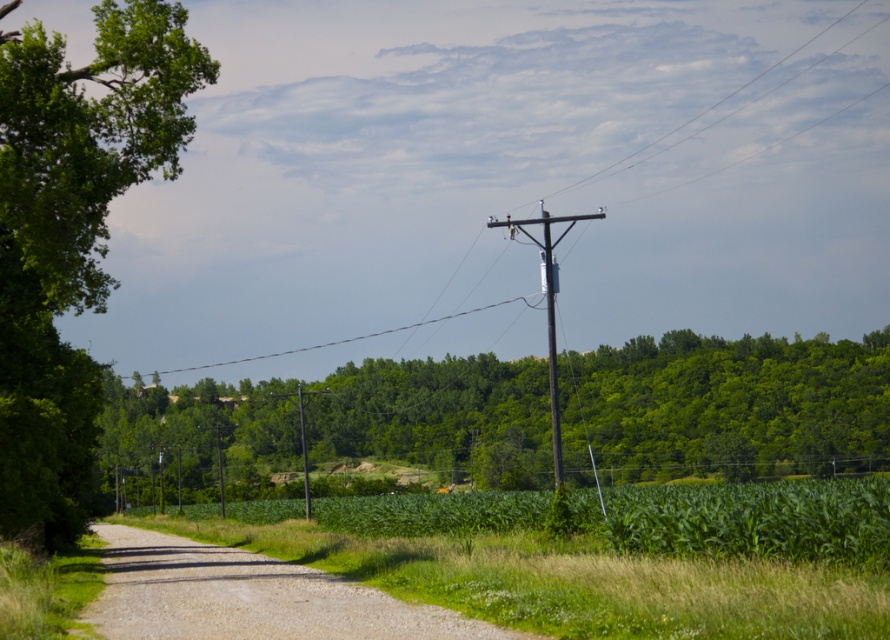
Question: Which object is positioned closest to the green leafy tree at center?

Choices:
 (A) metallic gray utility pole at center
 (B) brown wooden pole at center
 (C) brown wooden pole at upper center

Answer: (B)

Question: Can you confirm if green leafy corn field at center is positioned below metallic gray utility pole at center?

Choices:
 (A) yes
 (B) no

Answer: (A)

Question: Does brown wooden telegraph pole at center have a smaller size compared to brown wooden pole at center?

Choices:
 (A) no
 (B) yes

Answer: (A)

Question: Which of the following is the farthest from the observer?

Choices:
 (A) brown wooden pole at upper center
 (B) brown wooden pole at center

Answer: (B)

Question: Among these points, which one is farthest from the camera?

Choices:
 (A) (488, 515)
 (B) (547, 218)
 (C) (555, 468)
 (D) (53, 468)

Answer: (A)

Question: Does brown wooden pole at upper center have a lesser width compared to green leafy tree at left?

Choices:
 (A) yes
 (B) no

Answer: (B)